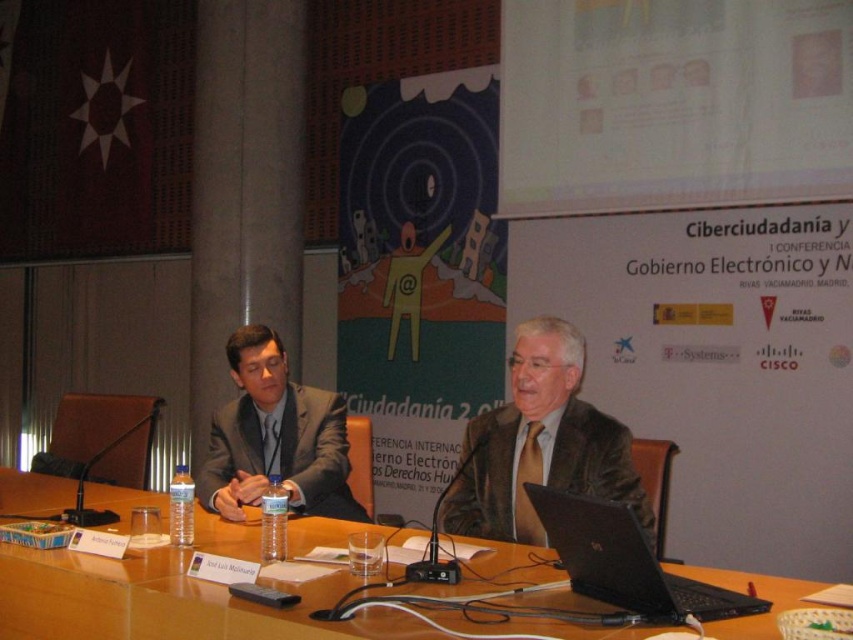
Can you confirm if wooden table at center is positioned to the right of black plastic laptop at center?

In fact, wooden table at center is to the left of black plastic laptop at center.

This screenshot has height=640, width=853. Identify the location of wooden table at center. (163, 602).

Who is lower down, gray concrete pillar at center or brown leather jacket at center?

brown leather jacket at center

Can you confirm if gray concrete pillar at center is thinner than brown leather jacket at center?

In fact, gray concrete pillar at center might be wider than brown leather jacket at center.

Is point (299, 68) positioned behind point (569, 420)?

Yes, it is behind point (569, 420).

You are a GUI agent. You are given a task and a screenshot of the screen. Output one action in this format:
    pyautogui.click(x=<x>, y=<y>)
    Task: Click on the gray concrete pillar at center
    The image size is (853, 640).
    Given the screenshot: What is the action you would take?
    pyautogui.click(x=244, y=188)

Who is lower down, brown leather jacket at center or black plastic laptop at center?

black plastic laptop at center is below.

Can you confirm if brown leather jacket at center is shorter than black plastic laptop at center?

In fact, brown leather jacket at center may be taller than black plastic laptop at center.

You are a GUI agent. You are given a task and a screenshot of the screen. Output one action in this format:
    pyautogui.click(x=<x>, y=<y>)
    Task: Click on the brown leather jacket at center
    
    Given the screenshot: What is the action you would take?
    pyautogui.click(x=538, y=444)